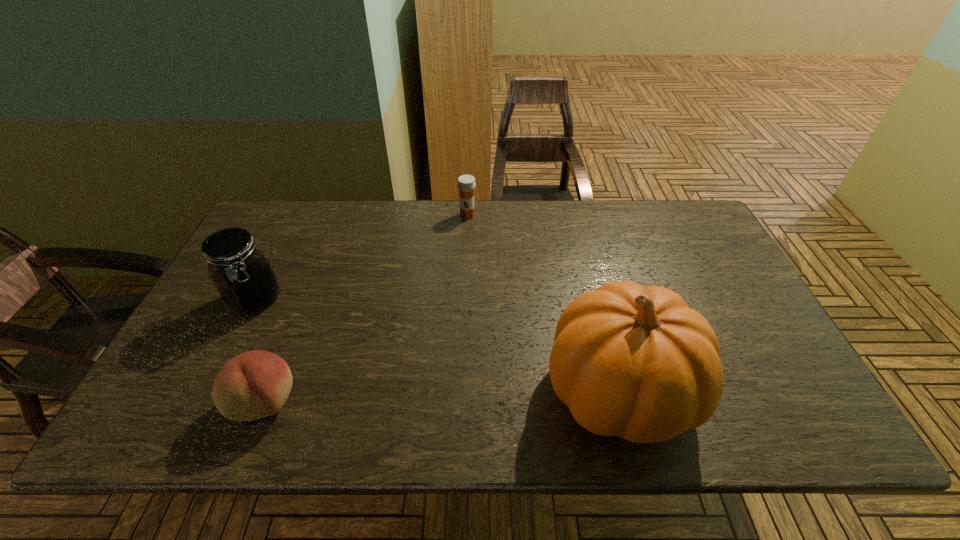
Identify the location of peach. The image size is (960, 540). (255, 384).

At what (x,y) coordinates should I click in order to perform the action: click on the rightmost object. Please return your answer as a coordinate pair (x, y). Image resolution: width=960 pixels, height=540 pixels. Looking at the image, I should click on (636, 362).

Find the location of a particular element. This screenshot has height=540, width=960. pumpkin is located at coordinates (636, 362).

Locate an element on the screen. The image size is (960, 540). medicine is located at coordinates (466, 183).

Identify the location of the second object from right to left. The height and width of the screenshot is (540, 960). (466, 183).

Where is `the third shortest object`? This screenshot has width=960, height=540. the third shortest object is located at coordinates (244, 278).

The image size is (960, 540). I want to click on the second farthest object, so click(244, 278).

You are a GUI agent. You are given a task and a screenshot of the screen. Output one action in this format:
    pyautogui.click(x=<x>, y=<y>)
    Task: Click on the vacant position located 0.100m on the back of the peach
    The height and width of the screenshot is (540, 960).
    Given the screenshot: What is the action you would take?
    (x=289, y=340)

I want to click on free space located 0.340m on the left of the tallest object, so click(x=393, y=390).

Where is `free space located on the label side of the medicine`? free space located on the label side of the medicine is located at coordinates (455, 251).